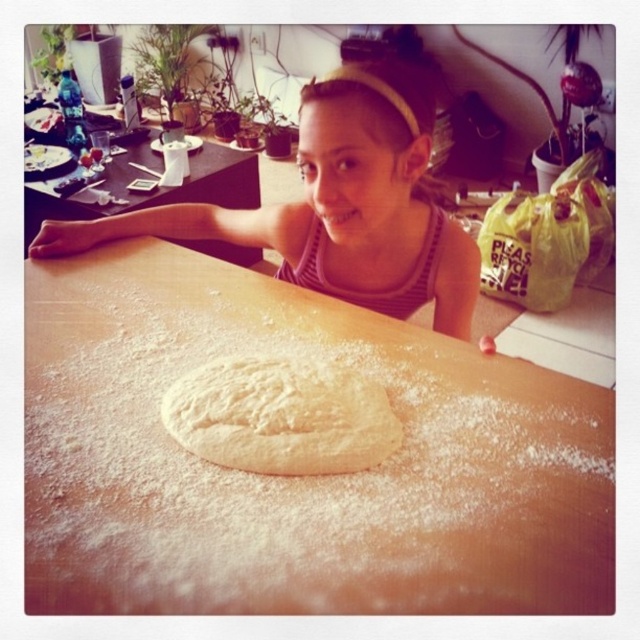
You are a fashion designer observing the kitchen scene. You need to determine if the pink striped tank top at upper center can be placed on the wooden table at upper left without overlapping its edges. Can you confirm?

The pink striped tank top at upper center has a lesser width compared to the wooden table at upper left, so it can be placed on the table without overlapping the edges.

You are standing in the kitchen and see two points marked in the scene. Based on their positions, which point is closer to you? The points are labeled as point (161, 228) and point (298, 413).

Point (298, 413) is closer to you because it is in front of point (161, 228).